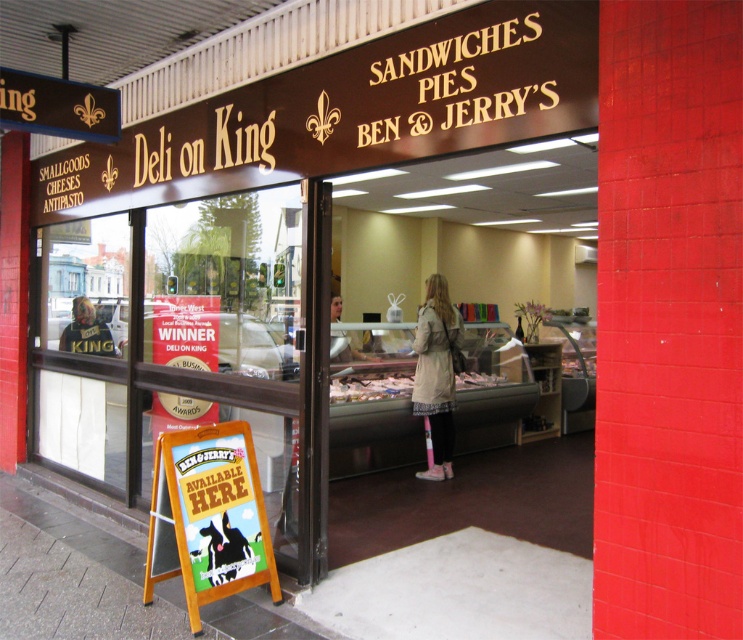
Is wooden signboard at lower left in front of light beige trench coat at center?

That is True.

Does wooden signboard at lower left lie behind light beige trench coat at center?

That is False.

Who is more forward, (247, 520) or (441, 314)?

Point (247, 520) is more forward.

Locate an element on the screen. Image resolution: width=743 pixels, height=640 pixels. wooden signboard at lower left is located at coordinates (207, 516).